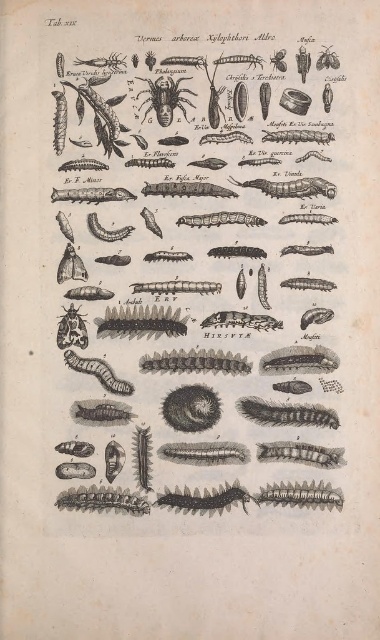
Who is more forward, (232,144) or (68,364)?

Point (232,144)

Looking at this image, who is positioned more to the left, black ink caterpillar at center or grayish matte caterpillar at center?

grayish matte caterpillar at center

Does point (234, 266) come in front of point (123, 384)?

No, it is behind (123, 384).

This screenshot has height=640, width=380. In order to click on black ink caterpillar at center in this screenshot , I will do `click(193, 280)`.

Does grayish-brown textured caterpillar at center appear on the right side of grayish matte caterpillar at center?

Indeed, grayish-brown textured caterpillar at center is positioned on the right side of grayish matte caterpillar at center.

Can you confirm if grayish-brown textured caterpillar at center is positioned above grayish matte caterpillar at center?

No, grayish-brown textured caterpillar at center is not above grayish matte caterpillar at center.

Is point (254, 416) behind point (106, 364)?

No, it is not.

This screenshot has height=640, width=380. Identify the location of grayish-brown textured caterpillar at center. (286, 413).

Does black ink caterpillar at center have a larger size compared to grayish-brown textured caterpillar at center?

Correct, black ink caterpillar at center is larger in size than grayish-brown textured caterpillar at center.

Does point (234, 150) lie behind point (278, 424)?

Yes, it is behind point (278, 424).

Locate an element on the screen. black ink caterpillar at center is located at coordinates (193, 280).